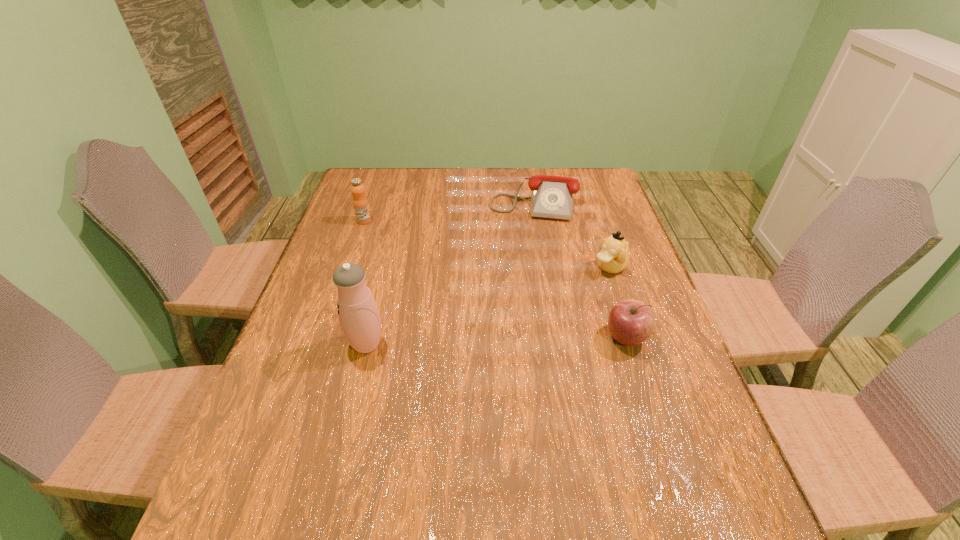
Identify the location of vacant area that lies between the tallest object and the leftmost object. The image size is (960, 540). (366, 282).

Where is `unoccupied area between the apple and the shortest object`? unoccupied area between the apple and the shortest object is located at coordinates (579, 269).

Point out which object is positioned as the fourth nearest to the apple. Please provide its 2D coordinates. Your answer should be formatted as a tuple, i.e. [(x, y)], where the tuple contains the x and y coordinates of a point satisfying the conditions above.

[(360, 202)]

Image resolution: width=960 pixels, height=540 pixels. I want to click on object that is the fourth closest to the third nearest object, so click(x=360, y=202).

Locate an element on the screen. This screenshot has width=960, height=540. blank area in the image that satisfies the following two spatial constraints: 1. on the back side of the leftmost object; 2. on the left side of the telephone is located at coordinates click(x=372, y=201).

Where is `free region that satisfies the following two spatial constraints: 1. on the back side of the thermos bottle; 2. on the right side of the telephone`? Image resolution: width=960 pixels, height=540 pixels. free region that satisfies the following two spatial constraints: 1. on the back side of the thermos bottle; 2. on the right side of the telephone is located at coordinates (401, 201).